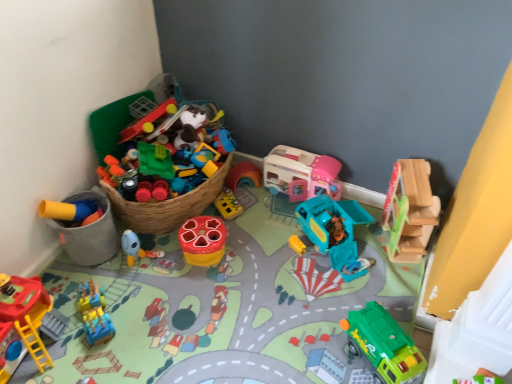
Find the location of a particular element. This screenshot has height=384, width=512. free space between green matte truck at lower right, which is the 7th toy from left to right, and rubberized yellow toy at left, which appears as the 8th toy when viewed from the right is located at coordinates (238, 305).